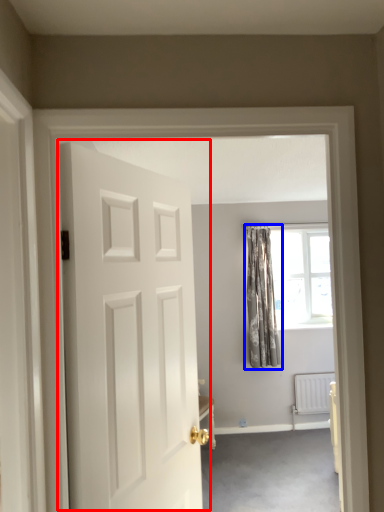
Question: Which of the following is the closest to the observer, door (highlighted by a red box) or curtain (highlighted by a blue box)?

Choices:
 (A) door
 (B) curtain

Answer: (A)